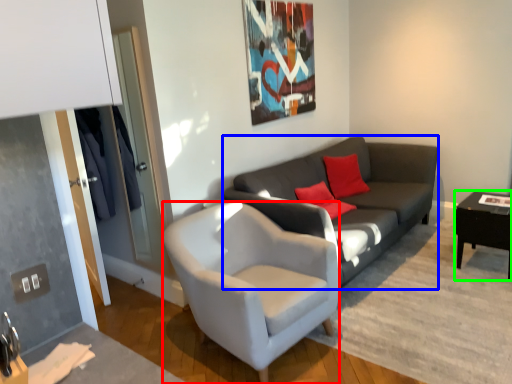
Question: Based on their relative distances, which object is nearer to chair (highlighted by a red box)? Choose from studio couch (highlighted by a blue box) and table (highlighted by a green box).

Choices:
 (A) studio couch
 (B) table

Answer: (A)